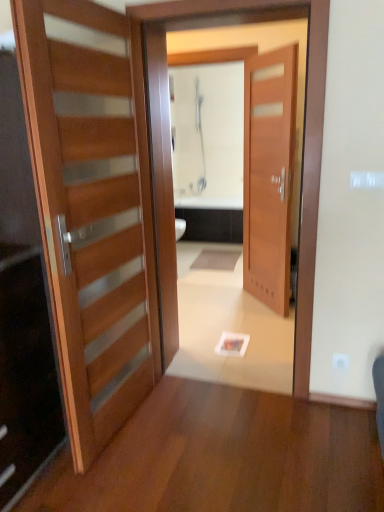
At what (x,y) coordinates should I click in order to perform the action: click on space that is in front of wooden door at left, acting as the 1th door starting from the front. Please return your answer as a coordinate pair (x, y). The image size is (384, 512). Looking at the image, I should click on (136, 467).